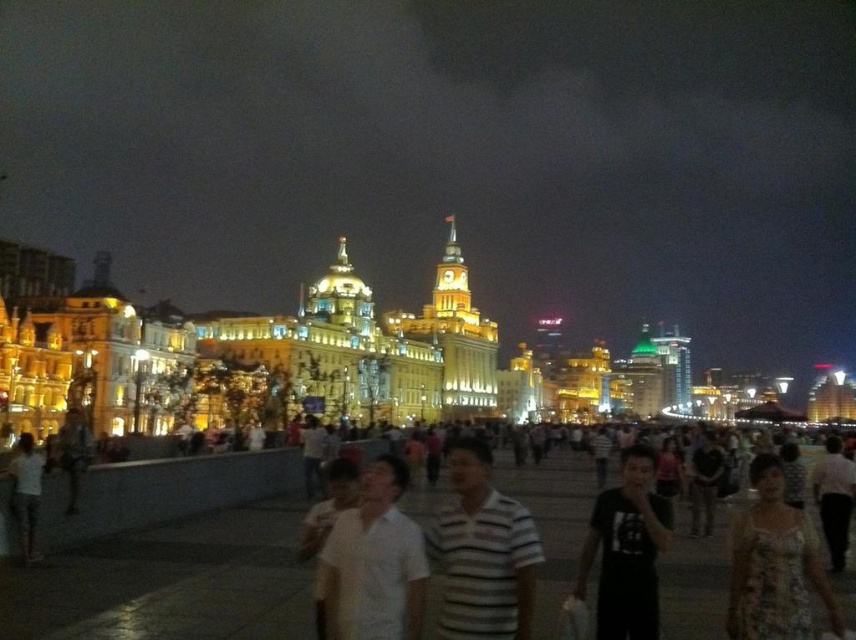
Question: Can you confirm if floral dress at lower right is positioned above black matte shirt at center?

Choices:
 (A) no
 (B) yes

Answer: (B)

Question: Observing the image, what is the correct spatial positioning of floral dress at lower right in reference to black matte shirt at center?

Choices:
 (A) left
 (B) right

Answer: (B)

Question: Is white matte shirt at center positioned before floral dress at lower right?

Choices:
 (A) no
 (B) yes

Answer: (B)

Question: Which object appears farthest from the camera in this image?

Choices:
 (A) white matte shirt at center
 (B) striped cotton shirt at center

Answer: (B)

Question: Which object is positioned farthest from the floral dress at lower right?

Choices:
 (A) white matte shirt at center
 (B) striped cotton shirt at center
 (C) black matte shirt at center

Answer: (A)

Question: Among these objects, which one is farthest from the camera?

Choices:
 (A) white matte shirt at center
 (B) floral dress at lower right

Answer: (B)